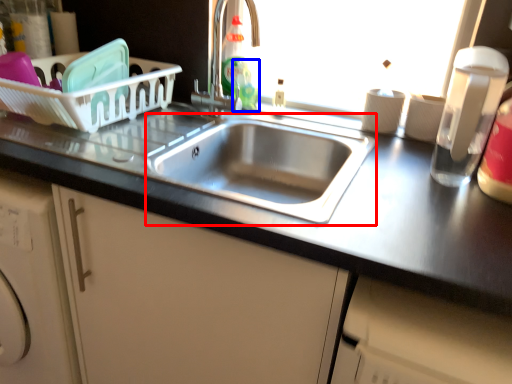
Question: Which of the following is the farthest to the observer, sink (highlighted by a red box) or bottle (highlighted by a blue box)?

Choices:
 (A) sink
 (B) bottle

Answer: (B)